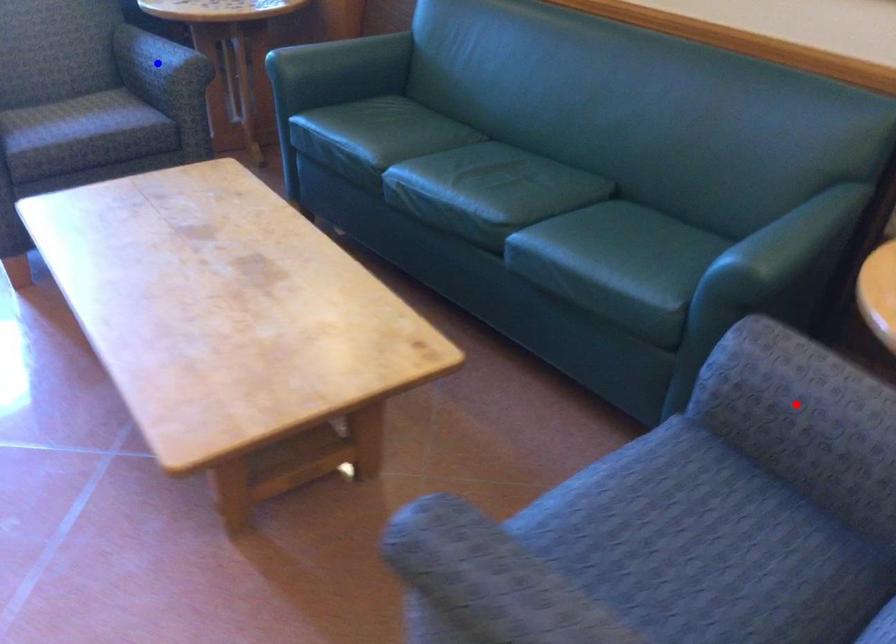
Question: In the image, two points are highlighted. Which point is nearer to the camera? Reply with the corresponding letter.

Choices:
 (A) blue point
 (B) red point

Answer: (B)